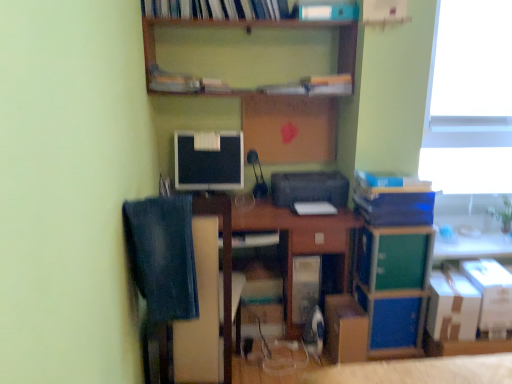
The width and height of the screenshot is (512, 384). I want to click on vacant area on top of white cardboard box at lower right, positioned as the 2th cardboard box in left-to-right order (from a real-world perspective), so click(x=457, y=282).